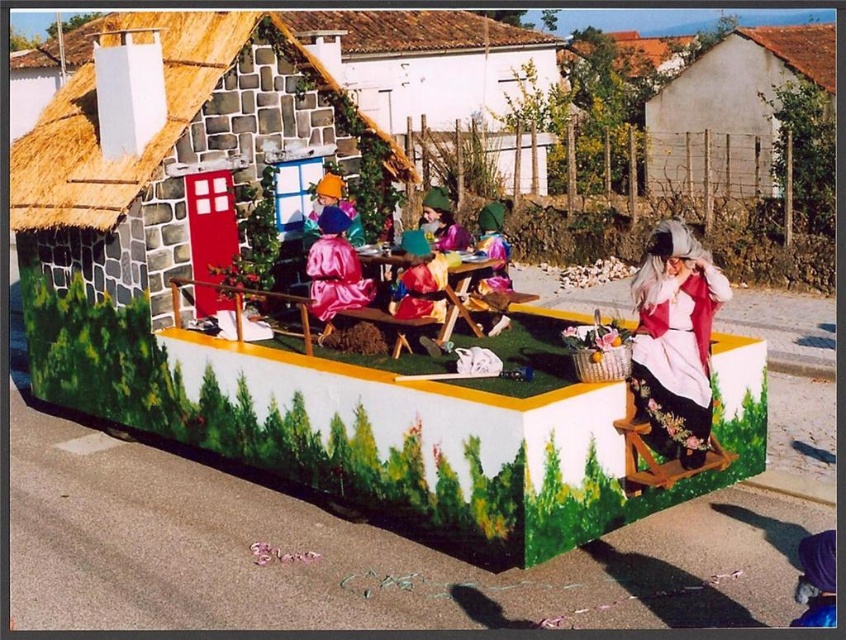
Question: Based on their relative distances, which object is nearer to the velvet purple dress at center?

Choices:
 (A) floral-patterned fabric dress at center
 (B) purple fabric at lower right
 (C) silky pink dress at center

Answer: (C)

Question: Which of the following is the farthest from the observer?

Choices:
 (A) (504, 252)
 (B) (363, 65)

Answer: (B)

Question: Among these objects, which one is farthest from the camera?

Choices:
 (A) thatched straw hut at center
 (B) silky pink dress at center
 (C) shiny purple dress at center

Answer: (A)

Question: Does white painted wood at upper right appear on the left side of silky pink dress at center?

Choices:
 (A) yes
 (B) no

Answer: (B)

Question: Does thatched straw hut at center have a greater width compared to floral-patterned fabric dress at center?

Choices:
 (A) no
 (B) yes

Answer: (B)

Question: Is stone textured hut at center positioned behind silky pink dress at center?

Choices:
 (A) yes
 (B) no

Answer: (A)